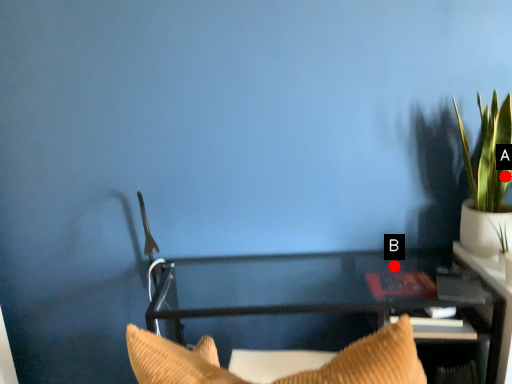
Question: Two points are circled on the image, labeled by A and B beside each circle. Among these points, which one is farthest from the camera?

Choices:
 (A) A is further
 (B) B is further

Answer: (B)